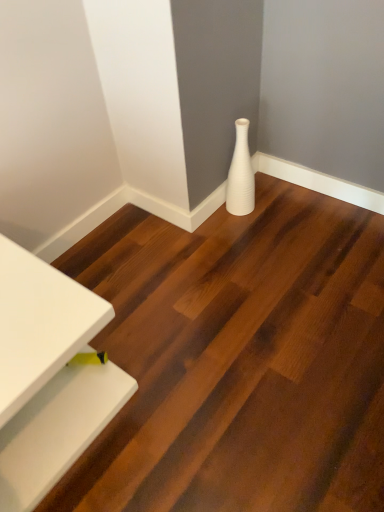
In order to click on vacant space to the right of white glossy table at lower left in this screenshot , I will do `click(181, 367)`.